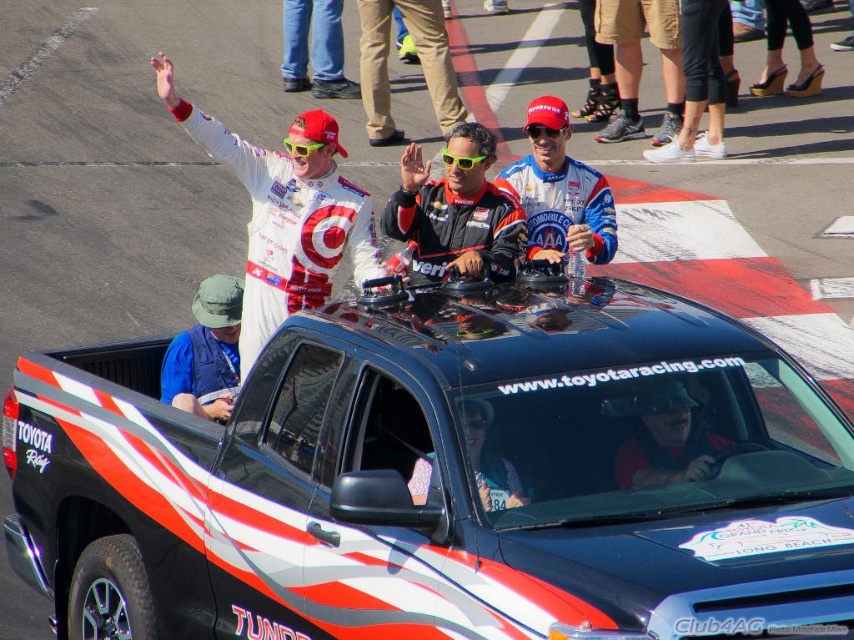
Question: Considering the real-world distances, which object is closest to the black leather helmet at center?

Choices:
 (A) green fabric hat at left
 (B) black matte racing suit at center
 (C) white glossy racing suit at upper left
 (D) black glossy pickup truck at center

Answer: (D)

Question: Is white glossy racing suit at upper left smaller than black leather helmet at center?

Choices:
 (A) no
 (B) yes

Answer: (A)

Question: Which of the following is the farthest from the observer?

Choices:
 (A) black glossy pickup truck at center
 (B) green fabric hat at left
 (C) white glossy racing suit at upper left

Answer: (C)

Question: Does white glossy racing suit at upper left have a lesser width compared to green fabric hat at left?

Choices:
 (A) no
 (B) yes

Answer: (A)

Question: Which point appears farthest from the camera in this image?

Choices:
 (A) (405, 173)
 (B) (214, 410)

Answer: (A)

Question: Can you confirm if white glossy racing suit at upper left is smaller than black matte racing suit at center?

Choices:
 (A) no
 (B) yes

Answer: (A)